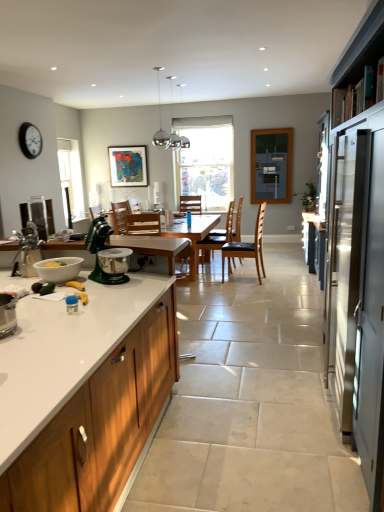
Locate an element on the screen. The width and height of the screenshot is (384, 512). wooden cabinet at left is located at coordinates (84, 394).

Find the location of `satin silver refrigerator at right`. satin silver refrigerator at right is located at coordinates (345, 267).

The image size is (384, 512). What do you see at coordinates (50, 217) in the screenshot?
I see `satin silver mixer at left, positioned as the 3th appliance in front-to-back order` at bounding box center [50, 217].

Where is `satin silver mixer at left, placed as the 1th appliance when sorted from left to right`? The height and width of the screenshot is (512, 384). satin silver mixer at left, placed as the 1th appliance when sorted from left to right is located at coordinates (50, 217).

Locate an element on the screen. The height and width of the screenshot is (512, 384). metallic silver toaster at lower left, marked as the 2th appliance in a left-to-right arrangement is located at coordinates (9, 308).

What is the approximate width of green metallic stand mixer at center, marked as the second appliance in a front-to-back arrangement?

It is 17.35 inches.

Where is `black leather chair at center, the 2th chair viewed from the back`? The image size is (384, 512). black leather chair at center, the 2th chair viewed from the back is located at coordinates (217, 234).

Where is `wooden cabinet at left`? wooden cabinet at left is located at coordinates (84, 394).

Considering the sizes of objects satin silver refrigerator at right and green metallic stand mixer at center, marked as the 1th appliance in a right-to-left arrangement, in the image provided, who is thinner, satin silver refrigerator at right or green metallic stand mixer at center, marked as the 1th appliance in a right-to-left arrangement,?

satin silver refrigerator at right is thinner.

Which is behind, satin silver refrigerator at right or green metallic stand mixer at center, which appears as the second appliance when viewed from the back?

green metallic stand mixer at center, which appears as the second appliance when viewed from the back, is behind.

How far apart are satin silver refrigerator at right and green metallic stand mixer at center, the 3th appliance positioned from the left?

1.54 meters.

Locate an element on the screen. the 1st appliance behind the satin silver refrigerator at right, counting from the anchor's position is located at coordinates (101, 249).

Would you say wooden cabinet at left is a long distance from transparent glass window at center?

Yes, wooden cabinet at left and transparent glass window at center are located far from each other.

How distant is wooden cabinet at left from transparent glass window at center?

wooden cabinet at left is 5.73 meters away from transparent glass window at center.

Between wooden cabinet at left and transparent glass window at center, which one appears on the right side from the viewer's perspective?

transparent glass window at center.

Is wooden cabinet at left oriented away from transparent glass window at center?

Yes, wooden cabinet at left is positioned with its back facing transparent glass window at center.

Considering the points (130, 225) and (54, 272), which point is in front, point (130, 225) or point (54, 272)?

Point (54, 272)

Can you confirm if wooden chair at center, which is counted as the first chair, starting from the front, is smaller than white glossy mixing bowl at lower left?

No.

In terms of height, does wooden chair at center, which is counted as the first chair, starting from the front, look taller or shorter compared to white glossy mixing bowl at lower left?

Clearly, wooden chair at center, which is counted as the first chair, starting from the front, is taller compared to white glossy mixing bowl at lower left.

Consider the image. How distant is white glossy mixing bowl at lower left from metallic silver toaster at lower left, the 3th appliance viewed from the back?

A distance of 14.18 inches exists between white glossy mixing bowl at lower left and metallic silver toaster at lower left, the 3th appliance viewed from the back.

Consider the image. Does white glossy mixing bowl at lower left touch metallic silver toaster at lower left, the 3th appliance viewed from the back?

No, white glossy mixing bowl at lower left is not touching metallic silver toaster at lower left, the 3th appliance viewed from the back.

Can you confirm if white glossy mixing bowl at lower left is positioned to the right of metallic silver toaster at lower left, marked as the 2th appliance in a left-to-right arrangement?

Correct, you'll find white glossy mixing bowl at lower left to the right of metallic silver toaster at lower left, marked as the 2th appliance in a left-to-right arrangement.

Considering the sizes of objects white glossy mixing bowl at lower left and metallic silver toaster at lower left, marked as the 2th appliance in a left-to-right arrangement, in the image provided, who is thinner, white glossy mixing bowl at lower left or metallic silver toaster at lower left, marked as the 2th appliance in a left-to-right arrangement,?

metallic silver toaster at lower left, marked as the 2th appliance in a left-to-right arrangement, is thinner.

Which point is more distant from viewer, (118, 167) or (11, 302)?

The point (118, 167) is farther.

Based on the photo, between matte wooden picture frame at upper center and metallic silver toaster at lower left, marked as the 2th appliance in a left-to-right arrangement, which one is positioned behind?

matte wooden picture frame at upper center.

Which of these two, matte wooden picture frame at upper center or metallic silver toaster at lower left, marked as the 2th appliance in a left-to-right arrangement, stands taller?

Standing taller between the two is matte wooden picture frame at upper center.

From the image's perspective, is matte wooden picture frame at upper center above metallic silver toaster at lower left, the second appliance positioned from the right?

Indeed, from the image's perspective, matte wooden picture frame at upper center is shown above metallic silver toaster at lower left, the second appliance positioned from the right.

Can you confirm if satin silver refrigerator at right is positioned to the left of matte wooden picture frame at upper center?

No.

Could you measure the distance between satin silver refrigerator at right and matte wooden picture frame at upper center?

A distance of 18.76 feet exists between satin silver refrigerator at right and matte wooden picture frame at upper center.

What's the angular difference between satin silver refrigerator at right and matte wooden picture frame at upper center's facing directions?

The facing directions of satin silver refrigerator at right and matte wooden picture frame at upper center are 91 degrees apart.

Is satin silver refrigerator at right positioned with its back to matte wooden picture frame at upper center?

No, matte wooden picture frame at upper center is not at the back of satin silver refrigerator at right.

Between black leather chair at center, placed as the 2th chair when sorted from front to back, and wooden cabinet at left, which one has larger width?

wooden cabinet at left is wider.

From a real-world perspective, is black leather chair at center, placed as the 2th chair when sorted from front to back, on wooden cabinet at left?

No, from a real-world perspective, black leather chair at center, placed as the 2th chair when sorted from front to back, is not over wooden cabinet at left

Is black leather chair at center, placed as the 3th chair when sorted from back to front, not within wooden cabinet at left?

Yes, black leather chair at center, placed as the 3th chair when sorted from back to front, is outside of wooden cabinet at left.

The height and width of the screenshot is (512, 384). I want to click on screen door in front of the green metallic stand mixer at center, marked as the second appliance in a front-to-back arrangement, so click(345, 267).

You are a GUI agent. You are given a task and a screenshot of the screen. Output one action in this format:
    pyautogui.click(x=<x>, y=<y>)
    Task: Click on the cabinetry that appears on the left of transparent glass window at center
    The image size is (384, 512).
    Given the screenshot: What is the action you would take?
    pyautogui.click(x=84, y=394)

Based on the photo, when comparing their distances from wooden chair at center, marked as the 4th chair in a back-to-front arrangement, does satin silver refrigerator at right or black leather chair at center, placed as the 3th chair when sorted from back to front, seem closer?

black leather chair at center, placed as the 3th chair when sorted from back to front, lies closer to wooden chair at center, marked as the 4th chair in a back-to-front arrangement, than the other object.

From the image, which object appears to be nearer to black leather chair at center, the 2th chair viewed from the back, matte black clock at upper left or transparent glass window at center?

transparent glass window at center is closer to black leather chair at center, the 2th chair viewed from the back.

Estimate the real-world distances between objects in this image. Which object is further from black leather chair at center, the 2th chair viewed from the back, metallic silver toaster at lower left, the second appliance positioned from the right, or wooden chair at center, which is counted as the 1th chair, starting from the back?

metallic silver toaster at lower left, the second appliance positioned from the right, lies further to black leather chair at center, the 2th chair viewed from the back, than the other object.

When comparing their distances from black leather chair at center, placed as the 3th chair when sorted from back to front, does blue glass window screen at upper center or black leather chair at center, the third chair viewed from the front, seem closer?

The object closer to black leather chair at center, placed as the 3th chair when sorted from back to front, is black leather chair at center, the third chair viewed from the front.

Based on their spatial positions, is green metallic stand mixer at center, marked as the 1th appliance in a right-to-left arrangement, or matte wooden picture frame at upper center further from blue glass window screen at upper center?

green metallic stand mixer at center, marked as the 1th appliance in a right-to-left arrangement.

From the picture: Estimate the real-world distances between objects in this image. Which object is closer to matte wooden picture frame at upper center, white glossy mixing bowl at lower left or wooden chair at center, marked as the 4th chair in a back-to-front arrangement?

wooden chair at center, marked as the 4th chair in a back-to-front arrangement, lies closer to matte wooden picture frame at upper center than the other object.

Estimate the real-world distances between objects in this image. Which object is further from white glossy mixing bowl at lower left, blue glass window screen at upper center or wooden chair at center, which is counted as the 1th chair, starting from the back?

blue glass window screen at upper center lies further to white glossy mixing bowl at lower left than the other object.

From the image, which object appears to be farther from blue glass window screen at upper center, black leather chair at center, placed as the 3th chair when sorted from back to front, or green metallic stand mixer at center, which appears as the second appliance when viewed from the back?

green metallic stand mixer at center, which appears as the second appliance when viewed from the back, is further to blue glass window screen at upper center.

This screenshot has height=512, width=384. In order to click on appliance positioned between white glossy mixing bowl at lower left and wooden chair at center, which is counted as the 1th chair, starting from the back, from near to far in this screenshot , I will do `click(50, 217)`.

Image resolution: width=384 pixels, height=512 pixels. What are the coordinates of `screen door between wooden cabinet at left and black leather chair at center, the 2th chair viewed from the back, from front to back` in the screenshot? It's located at (345, 267).

You are a GUI agent. You are given a task and a screenshot of the screen. Output one action in this format:
    pyautogui.click(x=<x>, y=<y>)
    Task: Click on the screen door between wooden cabinet at left and blue glass window screen at upper center along the z-axis
    Image resolution: width=384 pixels, height=512 pixels.
    Given the screenshot: What is the action you would take?
    pyautogui.click(x=345, y=267)

You are a GUI agent. You are given a task and a screenshot of the screen. Output one action in this format:
    pyautogui.click(x=<x>, y=<y>)
    Task: Click on the window screen between wooden table at center and transparent glass window at center along the z-axis
    This screenshot has width=384, height=512.
    Given the screenshot: What is the action you would take?
    pyautogui.click(x=271, y=165)